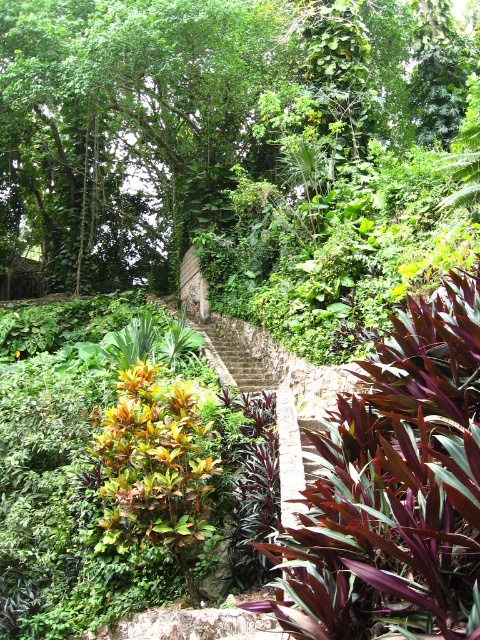
You are standing in the tropical garden and want to locate the green leafy tree at upper center. According to the coordinates provided, where would you look to find it?

The green leafy tree at upper center is located at coordinates point [195,115].

You are standing in the tropical garden and want to take a photo of both the point at coordinates point (191, 195) and the point at coordinates point (290, 621). Which point should you focus on first to ensure both are in focus?

You should focus on the point at coordinates point (191, 195) first because it is closer to you than the point at coordinates point (290, 621). This ensures both points will be in focus when using a camera with a fixed focal plane.

You are a gardener planning to prune plants in the tropical garden. You need to decide which plant requires more attention based on their sizes. Which one should you prioritize pruning first, the green leafy tree at upper center or the purple leathery leaves at center?

The green leafy tree at upper center has a larger size compared to the purple leathery leaves at center, so you should prioritize pruning the green leafy tree at upper center first due to its larger size.